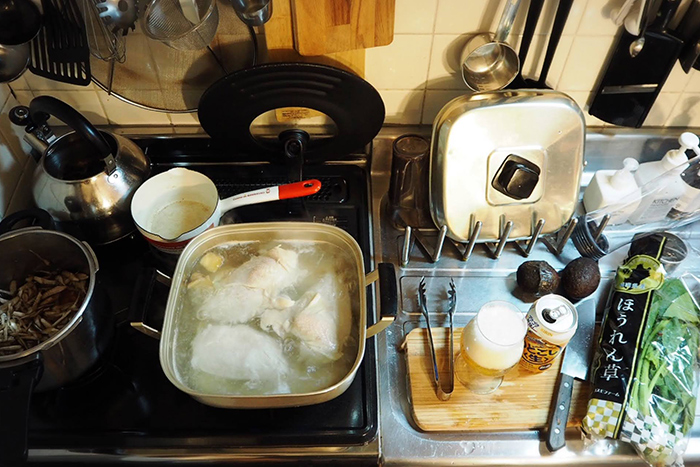
Where is `kettle`? The width and height of the screenshot is (700, 467). kettle is located at coordinates (80, 195).